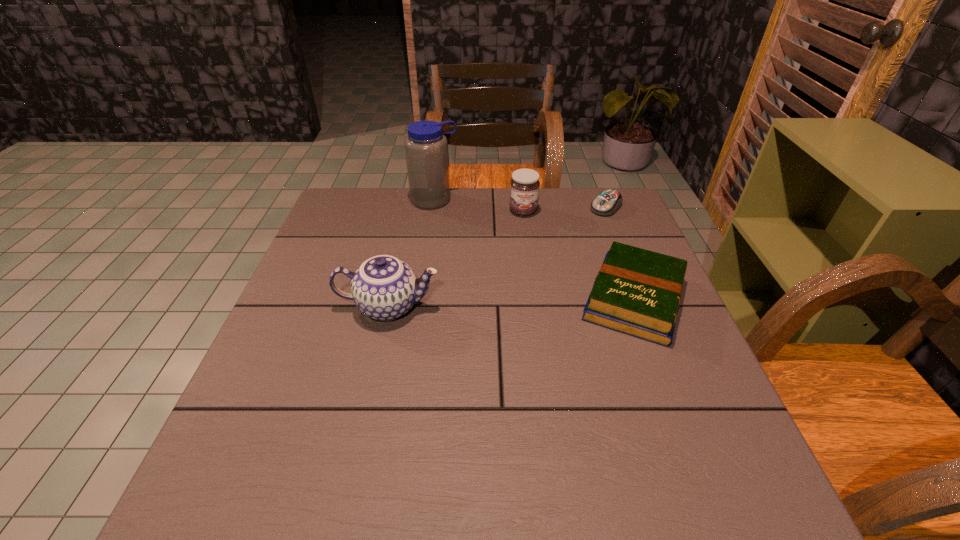
Identify which object is located as the fourth nearest to the tallest object. Please provide its 2D coordinates. Your answer should be formatted as a tuple, i.e. [(x, y)], where the tuple contains the x and y coordinates of a point satisfying the conditions above.

[(607, 202)]

Identify which object is the third nearest to the shortest object. Please provide its 2D coordinates. Your answer should be formatted as a tuple, i.e. [(x, y)], where the tuple contains the x and y coordinates of a point satisfying the conditions above.

[(426, 147)]

Image resolution: width=960 pixels, height=540 pixels. Identify the location of free location that satisfies the following two spatial constraints: 1. on the back side of the third shortest object; 2. on the right side of the shortest object. (522, 207).